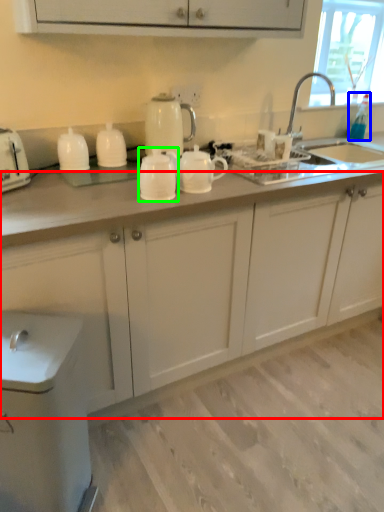
Question: Considering the real-world distances, which object is closest to cabinetry (highlighted by a red box)? bottle (highlighted by a blue box) or tableware (highlighted by a green box).

Choices:
 (A) bottle
 (B) tableware

Answer: (B)